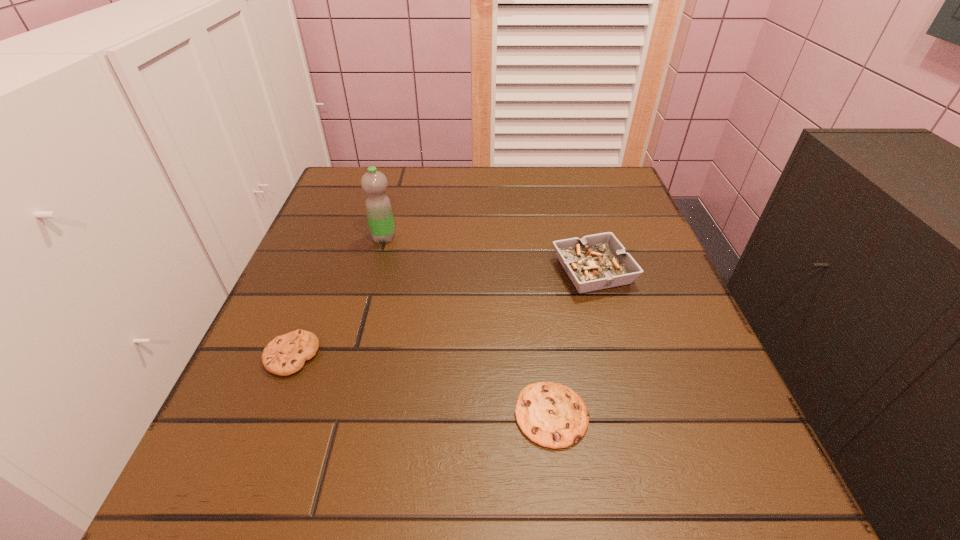
Identify the location of blank space located on the back of the farther cookie. (316, 294).

In order to click on vacant area located 0.050m on the right of the right cookie in this screenshot , I will do `click(623, 415)`.

Where is `water bottle that is at the left edge`? water bottle that is at the left edge is located at coordinates (378, 206).

Locate an element on the screen. The image size is (960, 540). cookie that is at the left edge is located at coordinates coord(286,354).

Image resolution: width=960 pixels, height=540 pixels. In order to click on object that is at the right edge in this screenshot , I will do 599,261.

Find the location of `vacant space at the far edge of the desktop`. vacant space at the far edge of the desktop is located at coordinates (542, 186).

You are a GUI agent. You are given a task and a screenshot of the screen. Output one action in this format:
    pyautogui.click(x=<x>, y=<y>)
    Task: Click on the vacant space at the near edge of the desktop
    The width and height of the screenshot is (960, 540).
    Given the screenshot: What is the action you would take?
    pyautogui.click(x=549, y=477)

Locate an element on the screen. blank space at the left edge is located at coordinates (348, 231).

The image size is (960, 540). Identify the location of vacant area at the right edge of the desktop. (622, 355).

You are a GUI agent. You are given a task and a screenshot of the screen. Output one action in this format:
    pyautogui.click(x=<x>, y=<y>)
    Task: Click on the vacant space at the near left corner of the desktop
    The width and height of the screenshot is (960, 540).
    Given the screenshot: What is the action you would take?
    pyautogui.click(x=312, y=483)